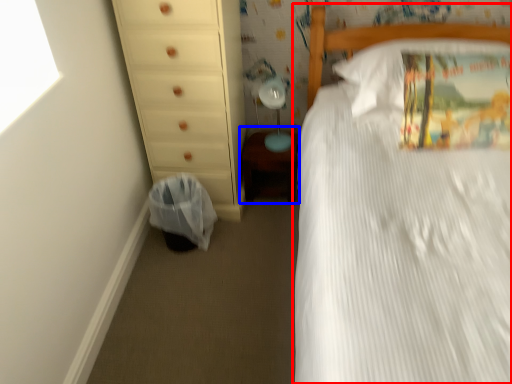
Question: Which object appears closest to the camera in this image, bed (highlighted by a red box) or changing table (highlighted by a blue box)?

Choices:
 (A) bed
 (B) changing table

Answer: (A)